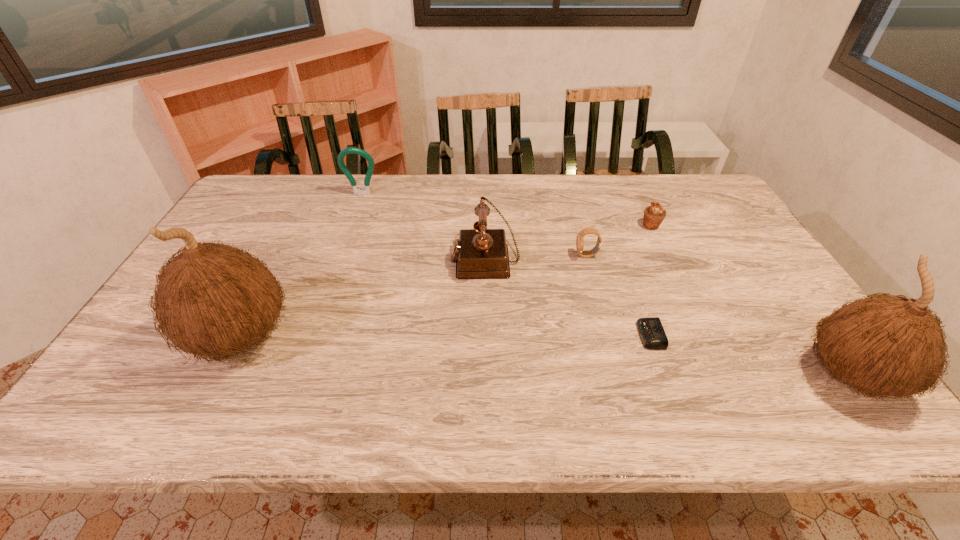
You are a GUI agent. You are given a task and a screenshot of the screen. Output one action in this format:
    pyautogui.click(x=<x>, y=<y>)
    Task: Click on the vacant area located 0.210m on the dial of the telephone
    This screenshot has height=540, width=960.
    Given the screenshot: What is the action you would take?
    pyautogui.click(x=379, y=258)

You are a GUI agent. You are given a task and a screenshot of the screen. Output one action in this format:
    pyautogui.click(x=<x>, y=<y>)
    Task: Click on the blank area located 0.310m on the display of the shortest object
    
    Given the screenshot: What is the action you would take?
    pyautogui.click(x=512, y=335)

Image resolution: width=960 pixels, height=540 pixels. What are the coordinates of `vacant region located 0.250m on the display of the shortest object` in the screenshot? It's located at point(536,335).

You are a GUI agent. You are given a task and a screenshot of the screen. Output one action in this format:
    pyautogui.click(x=<x>, y=<y>)
    Task: Click on the vacant space located on the display of the shortest object
    
    Given the screenshot: What is the action you would take?
    pyautogui.click(x=553, y=335)

The height and width of the screenshot is (540, 960). I want to click on object that is at the far edge, so click(366, 191).

At what (x,y) coordinates should I click in order to perform the action: click on alarm clock at the near edge. Please return your answer as a coordinate pair (x, y). Looking at the image, I should click on (652, 334).

The height and width of the screenshot is (540, 960). Find the location of `object situated at the left edge`. object situated at the left edge is located at coordinates (212, 299).

Locate an element on the screen. This screenshot has height=540, width=960. object present at the right edge is located at coordinates (887, 345).

Locate an element on the screen. This screenshot has width=960, height=540. object present at the near left corner is located at coordinates point(212,299).

Image resolution: width=960 pixels, height=540 pixels. What are the coordinates of `object positioned at the near right corner` in the screenshot? It's located at (887, 345).